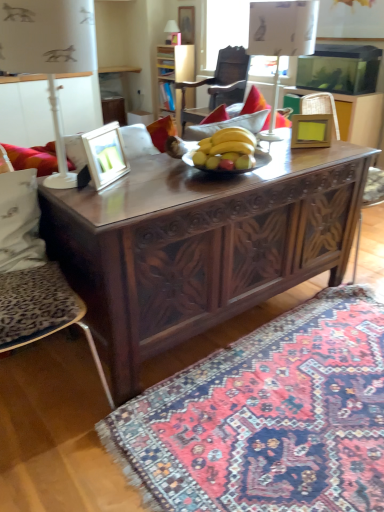
Question: From a real-world perspective, is matte wooden picture frame at left, which ranks as the third picture frame in back-to-front order, physically located above or below white plastic lamp at left, which appears as the 1th lamp when viewed from the front?

Choices:
 (A) above
 (B) below

Answer: (B)

Question: Considering their positions, is matte wooden picture frame at left, which ranks as the third picture frame in back-to-front order, located in front of or behind white plastic lamp at left, which is the 1th lamp from left to right?

Choices:
 (A) behind
 (B) front

Answer: (A)

Question: Estimate the real-world distances between objects in this image. Which object is closer to the wooden picture frame at upper center, arranged as the 1th picture frame when viewed from the top?

Choices:
 (A) matte wooden picture frame at left, the 1th picture frame positioned from the bottom
 (B) wooden photo frame at center, which is the second picture frame in back-to-front order
 (C) leopard print cushion at left, the 1th chair ordered from the bottom
 (D) dark wood carved table at center
 (E) matte white lampshade at upper center, acting as the second lamp starting from the left

Answer: (E)

Question: Which object is positioned closest to the white fabric pillow at left?

Choices:
 (A) matte white lampshade at upper center, which appears as the 2th lamp when viewed from the right
 (B) matte wooden picture frame at left, which ranks as the third picture frame in back-to-front order
 (C) dark wood carved dresser at upper center
 (D) wooden chair at center, arranged as the 2th chair when viewed from the front
 (E) wooden photo frame at center, which is the second picture frame in back-to-front order

Answer: (B)